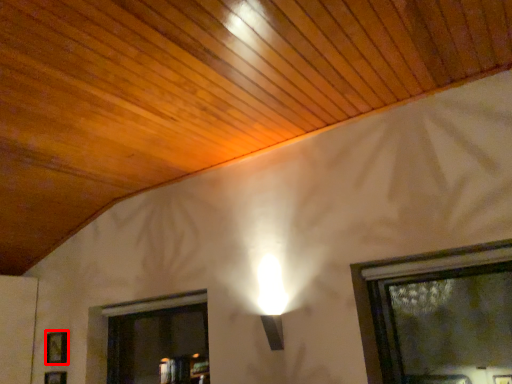
Question: Observing the image, what is the correct spatial positioning of picture frame (annotated by the red box) in reference to picture frame?

Choices:
 (A) left
 (B) right

Answer: (A)